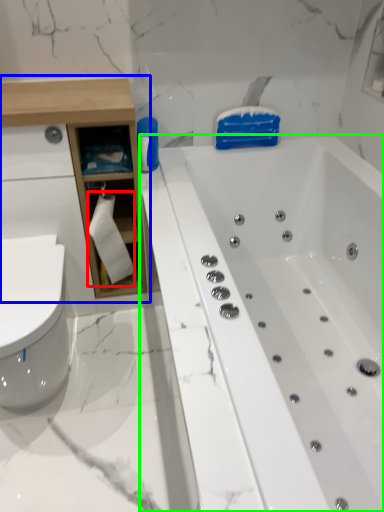
Question: Estimate the real-world distances between objects in this image. Which object is closer to toilet paper (highlighted by a red box), cabinetry (highlighted by a blue box) or bathtub (highlighted by a green box)?

Choices:
 (A) cabinetry
 (B) bathtub

Answer: (A)